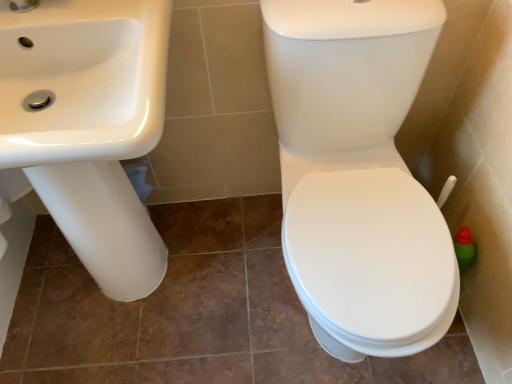
The image size is (512, 384). Find the location of `free space to the right of white glossy sink at left`. free space to the right of white glossy sink at left is located at coordinates point(239,281).